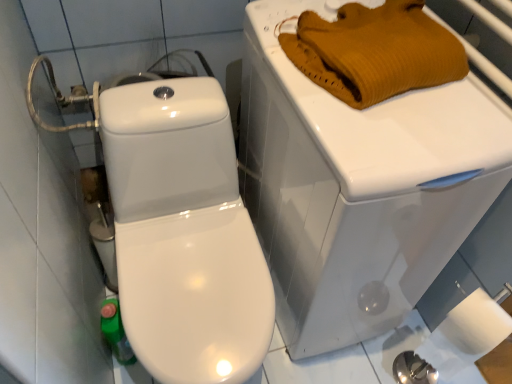
Question: Is white glossy porcelain at upper right bigger than knitted wool sweater at upper right?

Choices:
 (A) yes
 (B) no

Answer: (A)

Question: Would you say white glossy porcelain at upper right is outside knitted wool sweater at upper right?

Choices:
 (A) yes
 (B) no

Answer: (A)

Question: Is white glossy porcelain at upper right to the right of knitted wool sweater at upper right from the viewer's perspective?

Choices:
 (A) no
 (B) yes

Answer: (A)

Question: Does white glossy porcelain at upper right turn towards knitted wool sweater at upper right?

Choices:
 (A) no
 (B) yes

Answer: (A)

Question: Considering the relative positions of white glossy porcelain at upper right and knitted wool sweater at upper right in the image provided, is white glossy porcelain at upper right in front of knitted wool sweater at upper right?

Choices:
 (A) yes
 (B) no

Answer: (A)

Question: Is white glossy porcelain at upper right smaller than knitted wool sweater at upper right?

Choices:
 (A) no
 (B) yes

Answer: (A)

Question: Does knitted wool sweater at upper right have a greater height compared to white glossy porcelain at upper right?

Choices:
 (A) yes
 (B) no

Answer: (B)

Question: Is white glossy porcelain at upper right at the back of knitted wool sweater at upper right?

Choices:
 (A) no
 (B) yes

Answer: (B)

Question: Is knitted wool sweater at upper right not inside white glossy porcelain at upper right?

Choices:
 (A) no
 (B) yes

Answer: (A)

Question: From the image's perspective, would you say knitted wool sweater at upper right is positioned over white glossy porcelain at upper right?

Choices:
 (A) yes
 (B) no

Answer: (A)

Question: From the image's perspective, is knitted wool sweater at upper right located beneath white glossy porcelain at upper right?

Choices:
 (A) yes
 (B) no

Answer: (B)

Question: Considering the relative sizes of knitted wool sweater at upper right and white glossy porcelain at upper right in the image provided, is knitted wool sweater at upper right smaller than white glossy porcelain at upper right?

Choices:
 (A) yes
 (B) no

Answer: (A)

Question: Relative to white glossy porcelain at upper right, is knitted wool sweater at upper right in front or behind?

Choices:
 (A) front
 (B) behind

Answer: (B)